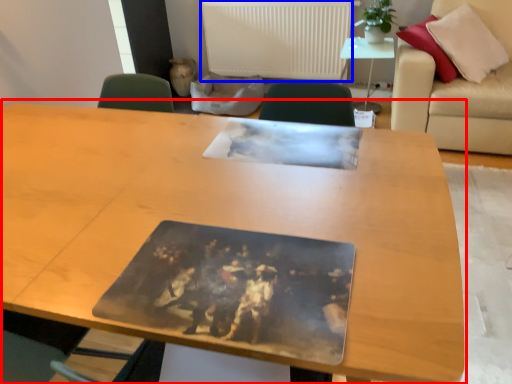
Question: Which point is closer to the camera, table (highlighted by a red box) or radiator (highlighted by a blue box)?

Choices:
 (A) table
 (B) radiator

Answer: (A)